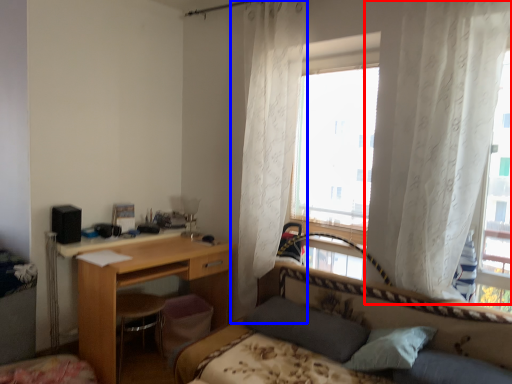
Question: Which of the following is the closest to the observer, curtain (highlighted by a red box) or curtain (highlighted by a blue box)?

Choices:
 (A) curtain
 (B) curtain

Answer: (A)